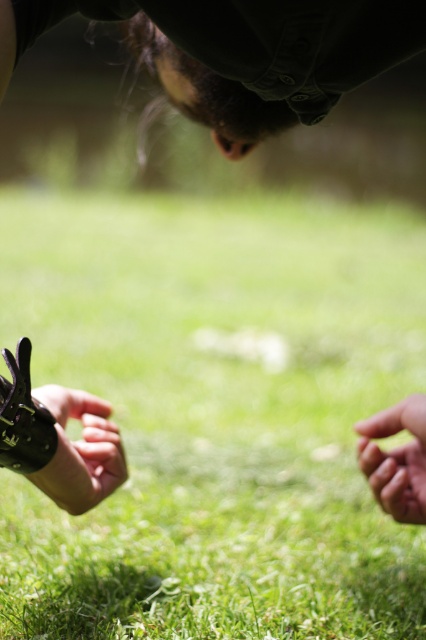
You are a photographer trying to capture a closeup of the green grass at center. You notice the smooth skin hand at lower right is blocking your view. Can you move the hand to the side without moving the grass?

The green grass at center is above the smooth skin hand at lower right, so you can move the hand to the side without affecting the grass.

Based on the scene description, where is the green grass at center located in terms of coordinates?

The green grass at center is located at point coordinates of [215,413].

You are a photographer standing in the middle of the green grass at center. You want to take a photo of the smooth skin hand at lower right. Can you reach it without moving your feet?

The distance between the green grass at center and the smooth skin hand at lower right is 1.95 meters. Since the photographer cannot stretch their arm that far, they would need to move their feet to reach the smooth skin hand at lower right.